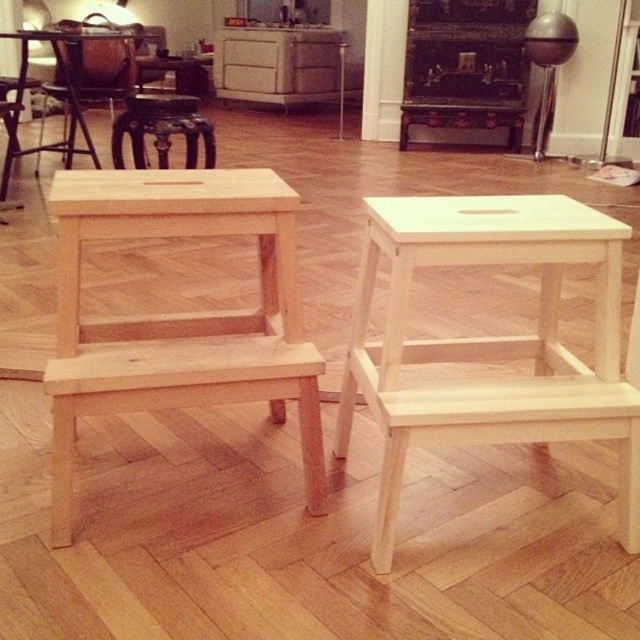
You are standing in the living room and want to place a small plant pot between the wooden stool at left and the wooden table at center. Which object should you move closer to you to make space?

The wooden stool at left is closer to the viewer than the wooden table at center, so you should move the wooden stool at left closer to you to make space.

You are arranging furniture in a living room and need to place the natural wood step stool at center and the wooden stool at left. Given their widths, which one should you place closer to the wall to save space?

The natural wood step stool at center has a lesser width compared to wooden stool at left, so placing the natural wood step stool at center closer to the wall would save more space since it takes up less horizontal space.

You are trying to reach a high shelf in the living room and see the natural wood step stool at left and the dark brown leather bar stool at center. Which one is closer to you?

The natural wood step stool at left is closer because it is in front of the dark brown leather bar stool at center.